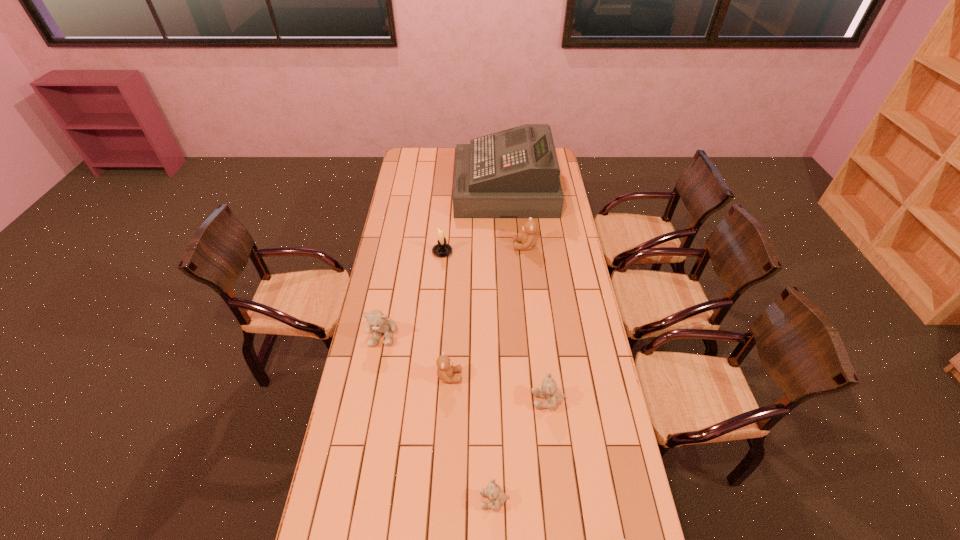
Image resolution: width=960 pixels, height=540 pixels. What are the coordinates of `the tallest object` in the screenshot? It's located at (514, 173).

Identify the location of the farthest object. The width and height of the screenshot is (960, 540). (514, 173).

This screenshot has width=960, height=540. What are the coordinates of `white candle holder` in the screenshot? It's located at point(442,249).

This screenshot has width=960, height=540. Identify the location of the second brown teddy bear from left to right. (528, 238).

I want to click on the farthest teddy bear, so click(x=528, y=238).

At what (x,y) coordinates should I click in order to perform the action: click on the leftmost object. Please return your answer as a coordinate pair (x, y). Looking at the image, I should click on (376, 320).

Identify the location of the biggest gray teddy bear. (376, 320).

Locate an element on the screen. the leftmost brown teddy bear is located at coordinates (445, 370).

Image resolution: width=960 pixels, height=540 pixels. I want to click on the second nearest brown teddy bear, so click(445, 370).

Find the location of a particular element. The image size is (960, 540). the sixth farthest object is located at coordinates (548, 390).